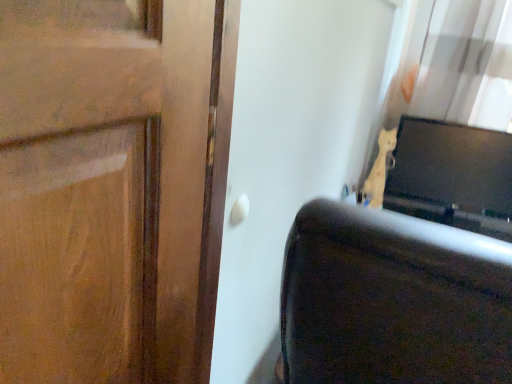
The image size is (512, 384). What are the coordinates of `velvet dark brown sofa at right` in the screenshot? It's located at (393, 300).

What do you see at coordinates (393, 300) in the screenshot? The width and height of the screenshot is (512, 384). I see `velvet dark brown sofa at right` at bounding box center [393, 300].

The image size is (512, 384). Find the location of `velvet dark brown sofa at right`. velvet dark brown sofa at right is located at coordinates [x=393, y=300].